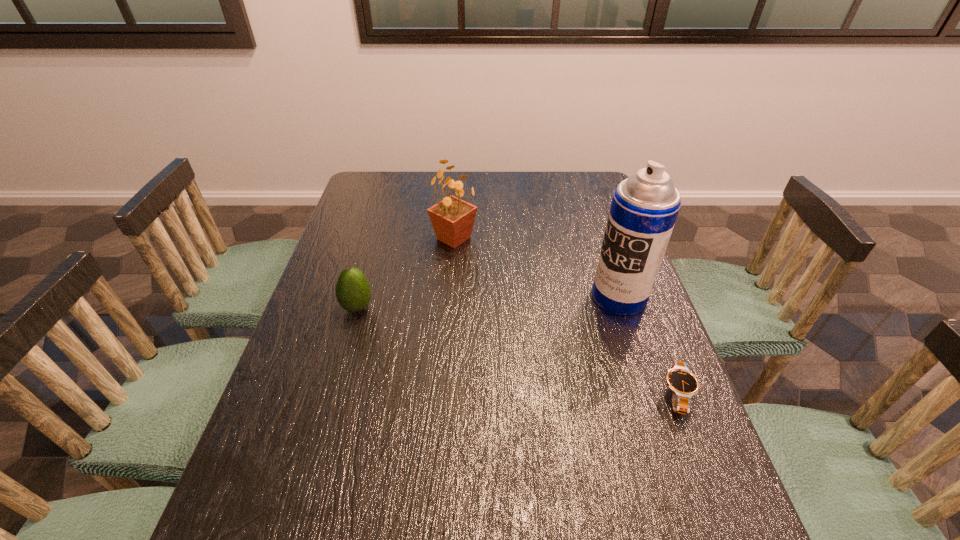
Find the location of `vacant spot on the desktop that is between the avocado and the nearest object and is positioned at the front of the sunflower with flowers visible`. vacant spot on the desktop that is between the avocado and the nearest object and is positioned at the front of the sunflower with flowers visible is located at coordinates (461, 335).

This screenshot has height=540, width=960. Find the location of `vacant space on the desktop that is between the third tallest object and the watch and is positioned on the label side of the aerosol can`. vacant space on the desktop that is between the third tallest object and the watch and is positioned on the label side of the aerosol can is located at coordinates (511, 349).